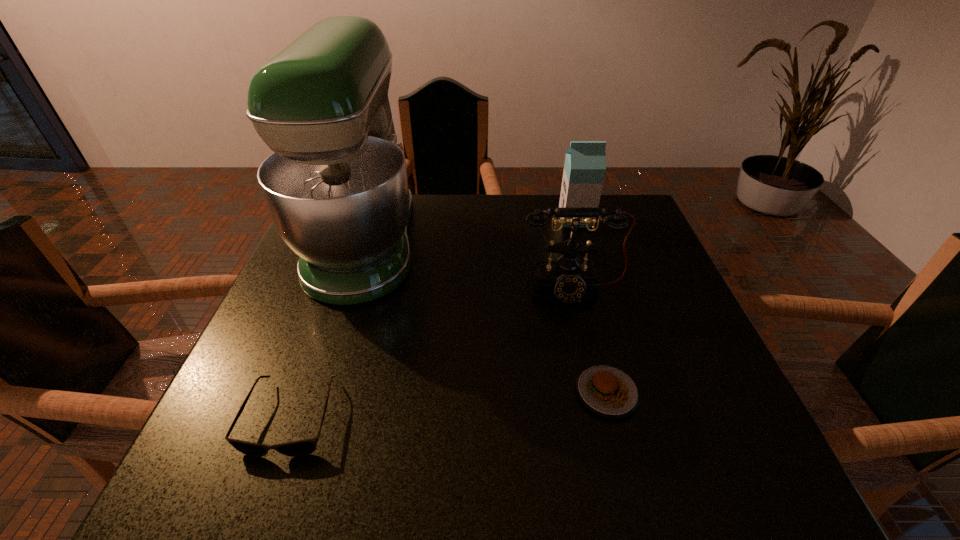
Locate an element on the screen. The width and height of the screenshot is (960, 540). vacant space at the near edge of the desktop is located at coordinates (330, 458).

At what (x,y) coordinates should I click in order to perform the action: click on vacant space at the right edge. Please return your answer as a coordinate pair (x, y). The width and height of the screenshot is (960, 540). Looking at the image, I should click on (621, 271).

Locate an element on the screen. Image resolution: width=960 pixels, height=540 pixels. free region at the far right corner of the desktop is located at coordinates (637, 241).

Find the location of a particular element. empty location between the food and the sunglasses is located at coordinates (449, 404).

I want to click on free space between the tallest object and the sunglasses, so click(328, 330).

In order to click on vacant area that lies between the sunglasses and the milk carton in this screenshot , I will do `click(434, 318)`.

Find the location of a particular element. vacant space in between the sunglasses and the milk carton is located at coordinates (434, 318).

This screenshot has width=960, height=540. In order to click on free area in between the milk carton and the mixer in this screenshot , I will do `click(470, 231)`.

This screenshot has width=960, height=540. Identify the location of free space between the telephone and the food. (589, 341).

The height and width of the screenshot is (540, 960). I want to click on free space that is in between the milk carton and the tallest object, so click(470, 231).